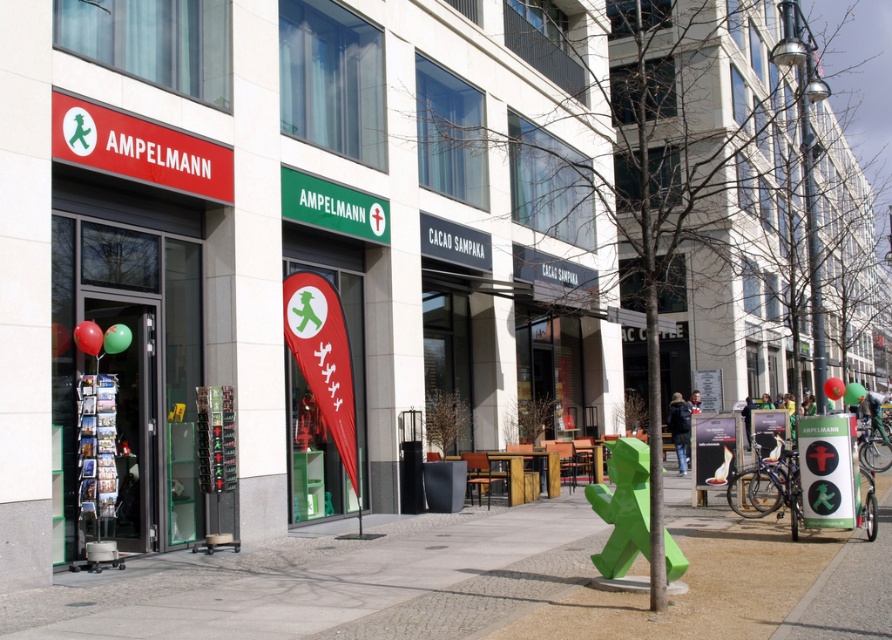
Between green concrete pavement at center and green plastic pedestrian sign at center, which one has less height?

green concrete pavement at center is shorter.

Where is `green concrete pavement at center`? Image resolution: width=892 pixels, height=640 pixels. green concrete pavement at center is located at coordinates (333, 582).

Can you confirm if green concrete pavement at center is positioned above green matte sign at center?

Incorrect, green concrete pavement at center is not positioned above green matte sign at center.

Describe the element at coordinates (333, 582) in the screenshot. This screenshot has height=640, width=892. I see `green concrete pavement at center` at that location.

Locate an element on the screen. green concrete pavement at center is located at coordinates (333, 582).

Does green plastic pedestrian sign at center appear under green matte sign at center?

Correct, green plastic pedestrian sign at center is located below green matte sign at center.

Does point (829, 484) lie behind point (364, 236)?

No, (829, 484) is closer to viewer.

Is point (844, 428) positioned behind point (312, 193)?

No, it is in front of (312, 193).

Locate an element on the screen. This screenshot has width=892, height=640. green plastic pedestrian sign at center is located at coordinates (826, 470).